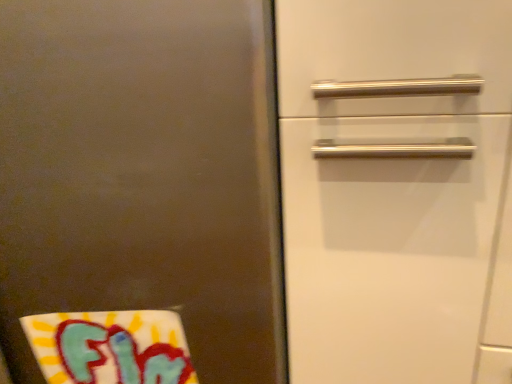
Question: Does brushed metal refrigerator at left have a lesser width compared to white fabric beach towel at lower left?

Choices:
 (A) yes
 (B) no

Answer: (B)

Question: Can you confirm if brushed metal refrigerator at left is wider than white fabric beach towel at lower left?

Choices:
 (A) yes
 (B) no

Answer: (A)

Question: Can you confirm if brushed metal refrigerator at left is shorter than white fabric beach towel at lower left?

Choices:
 (A) no
 (B) yes

Answer: (A)

Question: From a real-world perspective, is brushed metal refrigerator at left physically below white fabric beach towel at lower left?

Choices:
 (A) yes
 (B) no

Answer: (B)

Question: From a real-world perspective, is brushed metal refrigerator at left physically above white fabric beach towel at lower left?

Choices:
 (A) no
 (B) yes

Answer: (B)

Question: Can we say brushed metal refrigerator at left lies outside white fabric beach towel at lower left?

Choices:
 (A) no
 (B) yes

Answer: (B)

Question: From a real-world perspective, is white fabric beach towel at lower left under brushed metal refrigerator at left?

Choices:
 (A) yes
 (B) no

Answer: (A)

Question: Can brushed metal refrigerator at left be found inside white fabric beach towel at lower left?

Choices:
 (A) no
 (B) yes

Answer: (A)

Question: Is white fabric beach towel at lower left located outside brushed metal refrigerator at left?

Choices:
 (A) no
 (B) yes

Answer: (A)

Question: Is white fabric beach towel at lower left further to the viewer compared to brushed metal refrigerator at left?

Choices:
 (A) yes
 (B) no

Answer: (A)

Question: Is white fabric beach towel at lower left smaller than brushed metal refrigerator at left?

Choices:
 (A) yes
 (B) no

Answer: (A)

Question: Considering the relative positions of white fabric beach towel at lower left and brushed metal refrigerator at left in the image provided, is white fabric beach towel at lower left in front of brushed metal refrigerator at left?

Choices:
 (A) yes
 (B) no

Answer: (B)

Question: From a real-world perspective, is white fabric beach towel at lower left positioned above or below brushed metal refrigerator at left?

Choices:
 (A) below
 (B) above

Answer: (A)